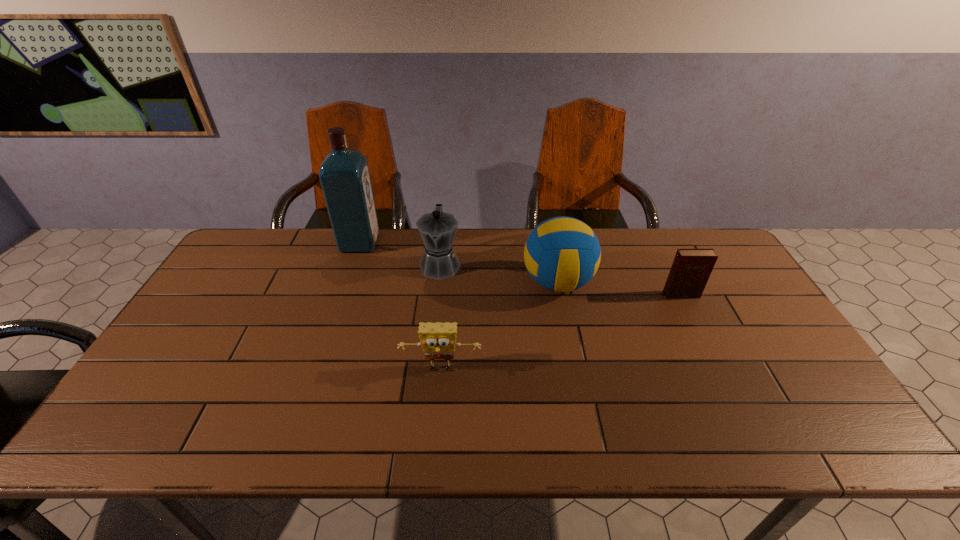
This screenshot has height=540, width=960. In order to click on free space located 0.170m on the face of the nearest object in this screenshot , I will do `click(435, 446)`.

You are a GUI agent. You are given a task and a screenshot of the screen. Output one action in this format:
    pyautogui.click(x=<x>, y=<y>)
    Task: Click on the liquor that is positioned at the far edge
    
    Given the screenshot: What is the action you would take?
    pyautogui.click(x=344, y=175)

Where is `volleyball that is positioned at the far edge`? The width and height of the screenshot is (960, 540). volleyball that is positioned at the far edge is located at coordinates (562, 254).

You are a GUI agent. You are given a task and a screenshot of the screen. Output one action in this format:
    pyautogui.click(x=<x>, y=<y>)
    Task: Click on the coffeepot positioned at the far edge
    The height and width of the screenshot is (540, 960).
    Given the screenshot: What is the action you would take?
    pyautogui.click(x=437, y=229)

In the image, there is a desktop. At what (x,y) coordinates should I click in order to perform the action: click on vacant space at the far edge. Please return your answer as a coordinate pair (x, y). Looking at the image, I should click on (351, 261).

In the image, there is a desktop. Where is `vacant space at the near edge`? The image size is (960, 540). vacant space at the near edge is located at coordinates (378, 438).

Image resolution: width=960 pixels, height=540 pixels. In order to click on vacant point at the left edge in this screenshot , I will do `click(191, 357)`.

In the image, there is a desktop. Where is `vacant space at the right edge`? Image resolution: width=960 pixels, height=540 pixels. vacant space at the right edge is located at coordinates (721, 319).

In the image, there is a desktop. Identify the location of vacant area at the far left corner. This screenshot has width=960, height=540. (245, 261).

Find the location of a particular element. free space at the near right corner is located at coordinates (774, 416).